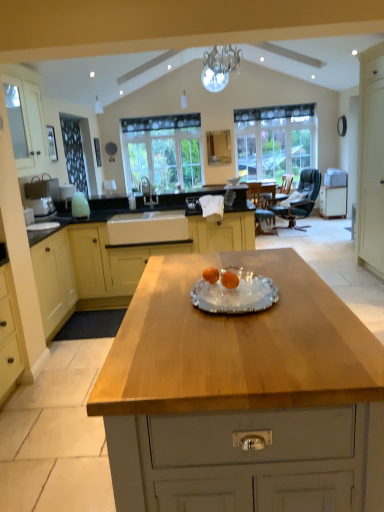
From the picture: Measure the distance between dark green fabric armchair at center and camera.

dark green fabric armchair at center and camera are 6.89 meters apart from each other.

What is the approximate width of wooden table at center?

It is 1.43 meters.

What do you see at coordinates (236, 345) in the screenshot? The image size is (384, 512). I see `wooden table at center` at bounding box center [236, 345].

The height and width of the screenshot is (512, 384). I want to click on white wood cabinet at left, acting as the first cabinetry starting from the front, so click(x=26, y=123).

The image size is (384, 512). What do you see at coordinates (163, 152) in the screenshot?
I see `clear glass window at center, acting as the 2th window starting from the right` at bounding box center [163, 152].

The width and height of the screenshot is (384, 512). Describe the element at coordinates (148, 192) in the screenshot. I see `white glossy sink at center` at that location.

I want to click on light wood/texture cabinet at center, which appears as the 2th cabinetry when viewed from the left, so click(118, 262).

Relative to clear glass window at center, the 2th window from the left, is dark green fabric armchair at center in front or behind?

Clearly, dark green fabric armchair at center is in front of clear glass window at center, the 2th window from the left.

Are dark green fabric armchair at center and clear glass window at center, the 1th window positioned from the right, located far from each other?

dark green fabric armchair at center is actually quite close to clear glass window at center, the 1th window positioned from the right.

How many degrees apart are the facing directions of dark green fabric armchair at center and clear glass window at center, the 2th window from the left?

dark green fabric armchair at center and clear glass window at center, the 2th window from the left, are facing 81.6 degrees away from each other.

Which of these two, dark green fabric armchair at center or clear glass window at center, the 1th window positioned from the right, is wider?

Wider between the two is dark green fabric armchair at center.

Between point (303, 143) and point (336, 201), which one is positioned behind?

The point (336, 201) is farther.

Based on their positions, is clear glass window at center, the 2th window from the left, located to the left or right of white wood cabinet at right, the first cabinetry viewed from the back?

→ Based on their positions, clear glass window at center, the 2th window from the left, is located to the left of white wood cabinet at right, the first cabinetry viewed from the back.

Considering the positions of objects clear glass window at center, the 2th window from the left, and white wood cabinet at right, the 4th cabinetry from the front, in the image provided, who is behind, clear glass window at center, the 2th window from the left, or white wood cabinet at right, the 4th cabinetry from the front,?

clear glass window at center, the 2th window from the left, is further away from the camera.

From the image's perspective, is clear glass window at center, the 1th window positioned from the right, above or below white wood cabinet at right, the first cabinetry viewed from the back?

From the image's perspective, clear glass window at center, the 1th window positioned from the right, appears above white wood cabinet at right, the first cabinetry viewed from the back.

Is point (290, 177) positioned before point (300, 204)?

Yes, point (290, 177) is in front of point (300, 204).

Is dark green fabric armchair at center facing towards dark green leather chair at right?

No, dark green fabric armchair at center does not turn towards dark green leather chair at right.

Consider the image. From a real-world perspective, is dark green fabric armchair at center on top of dark green leather chair at right?

Actually, dark green fabric armchair at center is physically below dark green leather chair at right in the real world.

Could white wood cabinet at right, the 4th cabinetry positioned from the left, be considered to be inside dark green fabric armchair at center?

No, white wood cabinet at right, the 4th cabinetry positioned from the left, is located outside of dark green fabric armchair at center.

Where is `cabinetry that is behind the dark green fabric armchair at center`? cabinetry that is behind the dark green fabric armchair at center is located at coordinates (333, 201).

Would you say dark green fabric armchair at center is a long distance from white wood cabinet at right, the 4th cabinetry positioned from the left?

No, dark green fabric armchair at center is not far away from white wood cabinet at right, the 4th cabinetry positioned from the left.

Who is more distant, dark green fabric armchair at center or white wood cabinet at right, the 4th cabinetry from the front?

white wood cabinet at right, the 4th cabinetry from the front, is behind.

Is white wood cabinet at right, the 4th cabinetry positioned from the left, to the left or to the right of clear glass window at center, the 1th window positioned from the right, in the image?

From the image, it's evident that white wood cabinet at right, the 4th cabinetry positioned from the left, is to the right of clear glass window at center, the 1th window positioned from the right.

Measure the distance between white wood cabinet at right, the 4th cabinetry positioned from the left, and clear glass window at center, the 1th window positioned from the right.

white wood cabinet at right, the 4th cabinetry positioned from the left, and clear glass window at center, the 1th window positioned from the right, are 4.06 feet apart from each other.

Considering the sizes of white wood cabinet at right, the 4th cabinetry positioned from the left, and clear glass window at center, the 1th window positioned from the right, in the image, is white wood cabinet at right, the 4th cabinetry positioned from the left, taller or shorter than clear glass window at center, the 1th window positioned from the right,?

Considering their sizes, white wood cabinet at right, the 4th cabinetry positioned from the left, has less height than clear glass window at center, the 1th window positioned from the right.

Which is closer to the camera, (x=345, y=210) or (x=302, y=115)?

Point (x=345, y=210) is positioned closer to the camera compared to point (x=302, y=115).

Considering the sizes of objects dark green leather chair at right and white wood cabinet at left, which ranks as the first cabinetry in left-to-right order, in the image provided, who is bigger, dark green leather chair at right or white wood cabinet at left, which ranks as the first cabinetry in left-to-right order,?

With larger size is dark green leather chair at right.

Based on the photo, from the image's perspective, would you say dark green leather chair at right is shown under white wood cabinet at left, acting as the fourth cabinetry starting from the back?

Yes, from the image's perspective, dark green leather chair at right is below white wood cabinet at left, acting as the fourth cabinetry starting from the back.

Between dark green leather chair at right and white wood cabinet at left, which ranks as the first cabinetry in left-to-right order, which one appears on the left side from the viewer's perspective?

From the viewer's perspective, white wood cabinet at left, which ranks as the first cabinetry in left-to-right order, appears more on the left side.

From the image's perspective, relative to clear glass window at center, the 2th window from the left, is dark green leather chair at right above or below?

Clearly, from the image's perspective, dark green leather chair at right is below clear glass window at center, the 2th window from the left.

Which is more to the left, dark green leather chair at right or clear glass window at center, the 2th window from the left?

clear glass window at center, the 2th window from the left, is more to the left.

Considering the positions of objects dark green leather chair at right and clear glass window at center, the 2th window from the left, in the image provided, who is in front, dark green leather chair at right or clear glass window at center, the 2th window from the left,?

dark green leather chair at right.

Would you say dark green leather chair at right contains clear glass window at center, the 2th window from the left?

No, clear glass window at center, the 2th window from the left, is located outside of dark green leather chair at right.

Which window is the 1st one when counting from the back of the dark green fabric armchair at center? Please provide its 2D coordinates.

[(275, 142)]

You are a GUI agent. You are given a task and a screenshot of the screen. Output one action in this format:
    pyautogui.click(x=<x>, y=<y>)
    Task: Click on the 3rd cabinetry directly beneath the clear glass window at center, the 2th window from the left (from a real-world perspective)
    This screenshot has height=512, width=384.
    Given the screenshot: What is the action you would take?
    pyautogui.click(x=333, y=201)

Considering their positions, is clear glass window at center, the 2th window from the left, positioned closer to dark green leather chair at right than dark green fabric armchair at center?

dark green fabric armchair at center lies closer to dark green leather chair at right than the other object.

When comparing their distances from light wood/texture cabinet at center, which is the 2th cabinetry from back to front, does dark green fabric armchair at center or clear glass window at center, the 2th window from the left, seem closer?

Among the two, dark green fabric armchair at center is located nearer to light wood/texture cabinet at center, which is the 2th cabinetry from back to front.

Which object lies nearer to the anchor point dark green leather chair at right, clear glass window at center, the 2th window from the left, or wooden table at center?

clear glass window at center, the 2th window from the left, lies closer to dark green leather chair at right than the other object.

Based on the photo, when comparing their distances from clear glass window at center, the 1th window when ordered from left to right, does white wood cabinet at right, the first cabinetry positioned from the right, or white glossy sink at center seem closer?

Among the two, white glossy sink at center is located nearer to clear glass window at center, the 1th window when ordered from left to right.

Looking at this image, which object lies nearer to the anchor point clear glass window at center, acting as the 2th window starting from the right, white glossy sink at center or white wood cabinet at left, acting as the fourth cabinetry starting from the back?

white glossy sink at center lies closer to clear glass window at center, acting as the 2th window starting from the right, than the other object.

When comparing their distances from white glossy sink at center, does light wood/texture cabinet at center, the third cabinetry from the front, or wooden table at center seem further?

Based on the image, wooden table at center appears to be further to white glossy sink at center.

From the image, which object appears to be farther from dark green fabric armchair at center, white wood door at right, positioned as the third cabinetry in left-to-right order, or dark green leather chair at right?

white wood door at right, positioned as the third cabinetry in left-to-right order.

From the image, which object appears to be nearer to white wood cabinet at right, the first cabinetry positioned from the right, white wood door at right, the 3th cabinetry from the back, or wooden table at center?

white wood door at right, the 3th cabinetry from the back, is positioned closer to the anchor white wood cabinet at right, the first cabinetry positioned from the right.

Find the location of a particular element. The image size is (384, 512). armchair between light wood/texture cabinet at center, which is the 2th cabinetry from back to front, and clear glass window at center, acting as the 2th window starting from the right, along the z-axis is located at coordinates (286, 184).

Identify the location of sink between light wood/texture cabinet at center, which appears as the 2th cabinetry when viewed from the left, and dark green leather chair at right in the front-back direction. (148, 192).

This screenshot has width=384, height=512. I want to click on armchair between wooden table at center and white wood cabinet at right, the first cabinetry positioned from the right, along the z-axis, so click(x=286, y=184).

The width and height of the screenshot is (384, 512). In order to click on armchair located between light wood/texture cabinet at center, acting as the 3th cabinetry starting from the right, and clear glass window at center, the 2th window from the left, in the depth direction in this screenshot , I will do `click(286, 184)`.